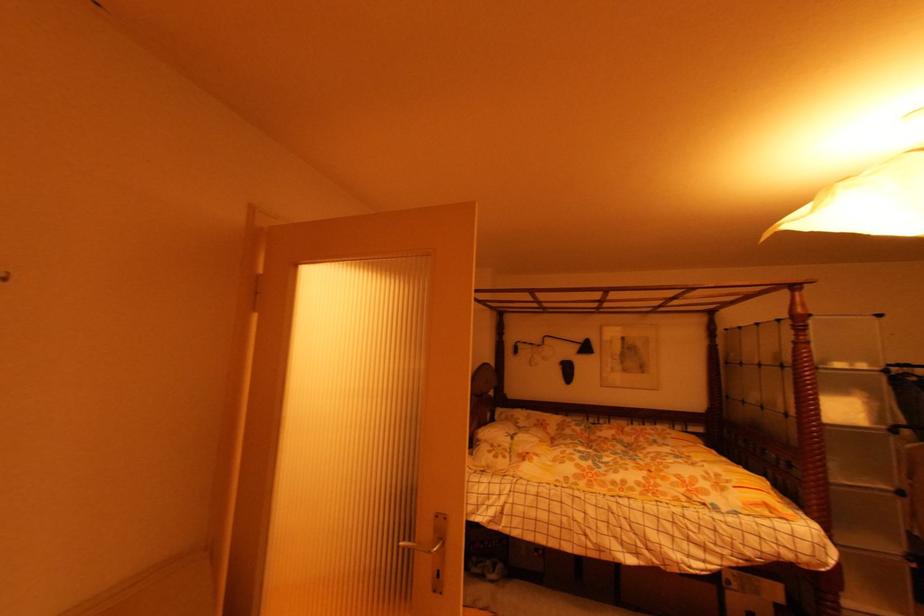
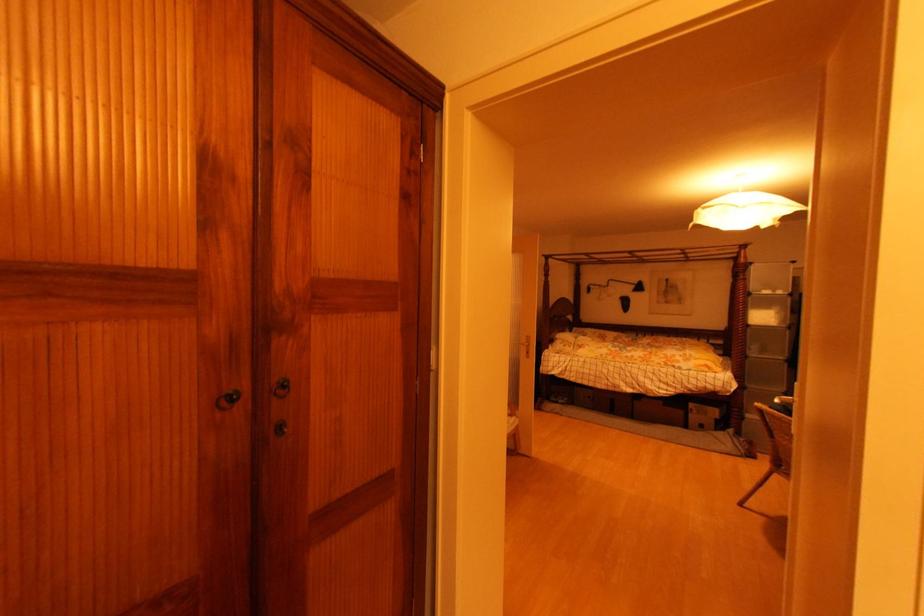
In the second image, find the point that corresponds to the point at 739,588 in the first image.

(699, 413)